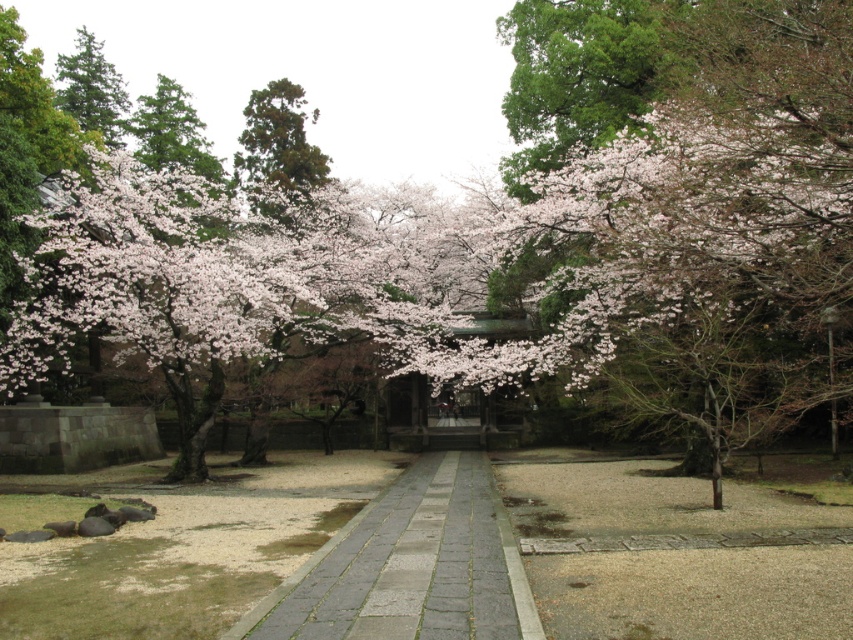
You are a visitor in the garden and want to walk on the gray stone pavement at center without stepping on the soft pink blossoms at center. Is this possible?

The soft pink blossoms at center are positioned over the gray stone pavement at center, so they are likely resting on top of the pavement. Therefore, it would be difficult to walk on the gray stone pavement at center without stepping on the soft pink blossoms at center.

Based on the photo, you are a visitor in the garden and want to take a photo of the gray stone pavement at center and the green matte tree at upper left. From which side of the path should you stand to ensure both objects are visible in your frame?

The gray stone pavement at center is located below the green matte tree at upper left, so standing on the side of the path opposite to the green matte tree at upper left will allow you to capture both in your photo.

You are standing at the entrance of the garden and want to take a photo of the soft pink blossoms at center. Where should you position yourself to capture them in the frame?

The soft pink blossoms at center are located at point 2D coordinates of (451, 253), so you should position yourself directly facing that coordinate point to capture them in the frame.